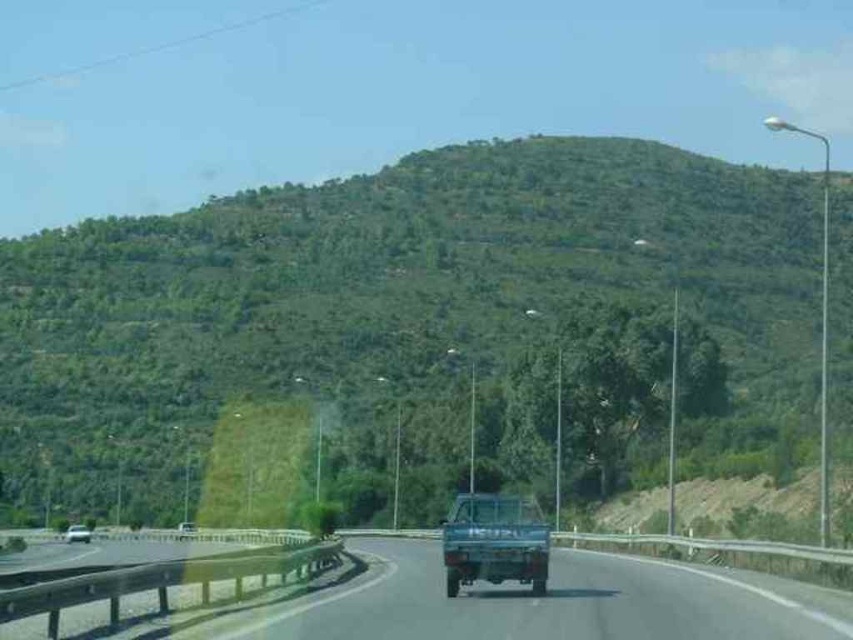
You are a passenger in the blue pickup truck driving on the highway. You notice the green leafy hillside at center and the metallic silver car at lower left. Which object is closer to you?

The metallic silver car at lower left is closer to you because the green leafy hillside at center is positioned over it, indicating that the car is behind the hillside from your perspective.

You are a driver approaching the green leafy hillside at center and the metallic silver car at lower left. Which object appears bigger in the scene?

The green leafy hillside at center is larger in size than the metallic silver car at lower left, so it appears bigger in the scene.

You are a driver approaching the highway and see the green leafy hillside at center and the metallic silver car at lower left. Which object is positioned to the right side of the other?

The green leafy hillside at center is to the right of metallic silver car at lower left.